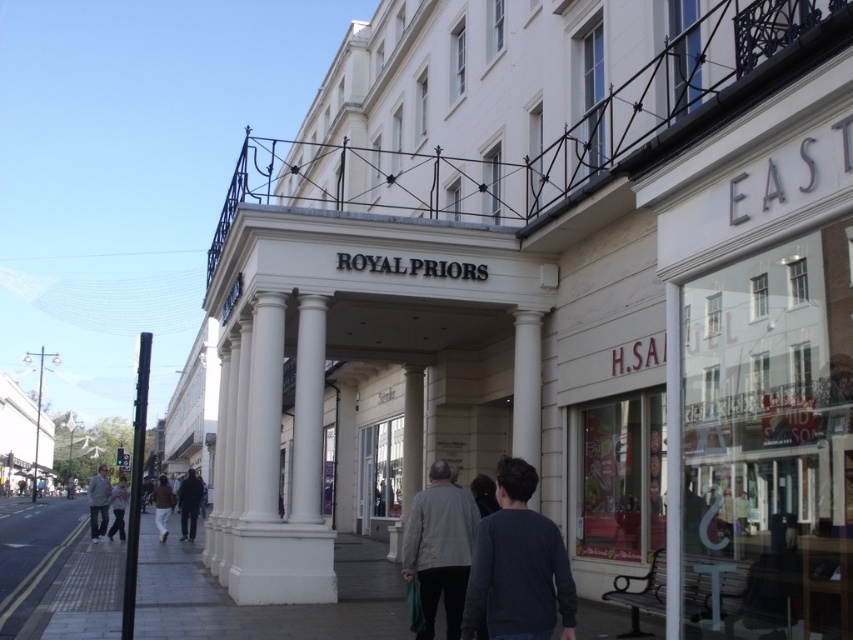
You are a customer entering the building and see both the dark blue jacket at center and the brown leather jacket at lower left. Which jacket is closer to you as you approach the entrance?

The dark blue jacket at center is closer to you than the brown leather jacket at lower left because it is further to the viewer.

Based on the photo, you are a customer entering the building and see the dark blue jacket at center and the brown leather jacket at lower left. Which jacket is shorter in height?

The dark blue jacket at center is shorter compared to the brown leather jacket at lower left.